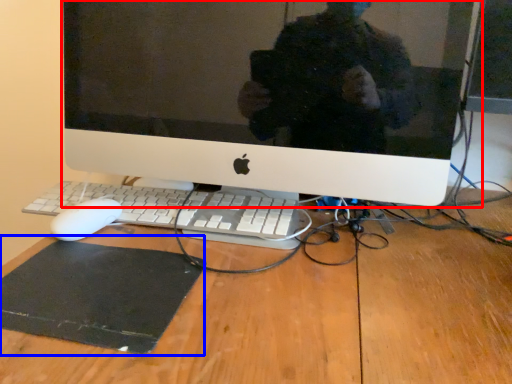
Question: Which point is further to the camera, computer monitor (highlighted by a red box) or mousepad (highlighted by a blue box)?

Choices:
 (A) computer monitor
 (B) mousepad

Answer: (A)